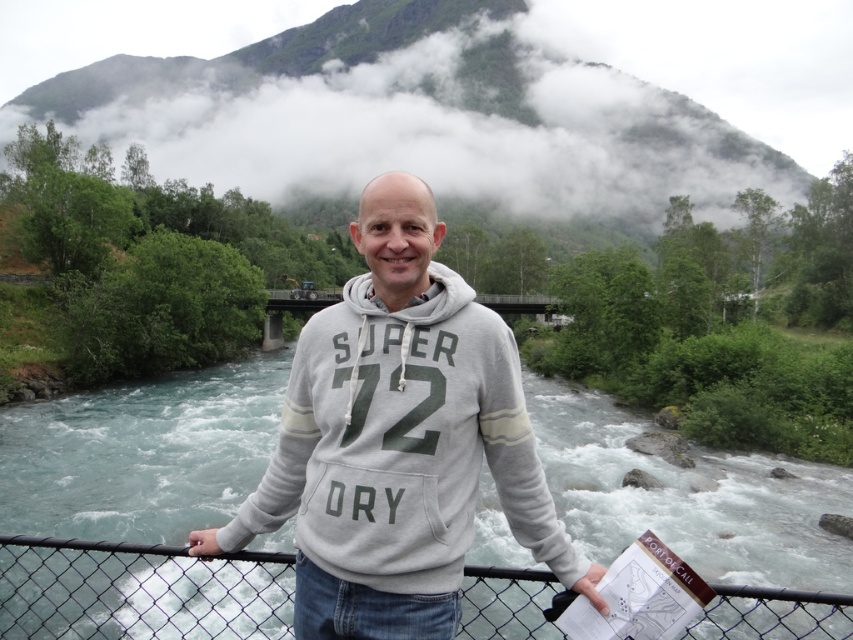
Question: Estimate the real-world distances between objects in this image. Which object is closer to the white fluffy cloud at upper center?

Choices:
 (A) gray cotton hoodie at center
 (B) wire mesh fence at center
 (C) clear water at center
 (D) concrete bridge at center

Answer: (D)

Question: Is white fluffy cloud at upper center wider than wire mesh fence at center?

Choices:
 (A) no
 (B) yes

Answer: (B)

Question: Does gray cotton hoodie at center appear over concrete bridge at center?

Choices:
 (A) yes
 (B) no

Answer: (B)

Question: Estimate the real-world distances between objects in this image. Which object is farther from the white fluffy cloud at upper center?

Choices:
 (A) gray cotton hoodie at center
 (B) wire mesh fence at center
 (C) clear water at center
 (D) concrete bridge at center

Answer: (A)

Question: Among these objects, which one is nearest to the camera?

Choices:
 (A) gray cotton hoodie at center
 (B) white fluffy cloud at upper center
 (C) clear water at center

Answer: (A)

Question: Is white fluffy cloud at upper center thinner than gray cotton hoodie at center?

Choices:
 (A) yes
 (B) no

Answer: (B)